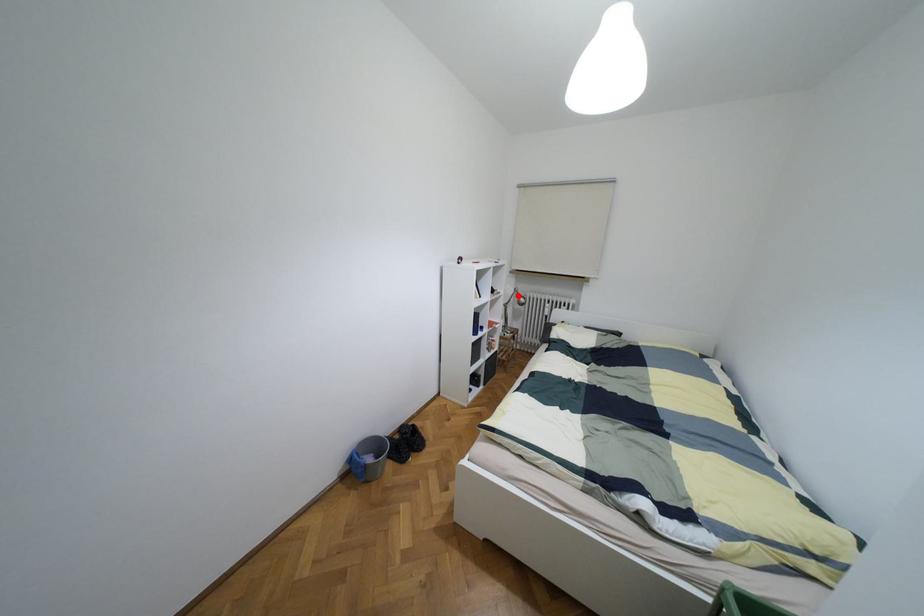
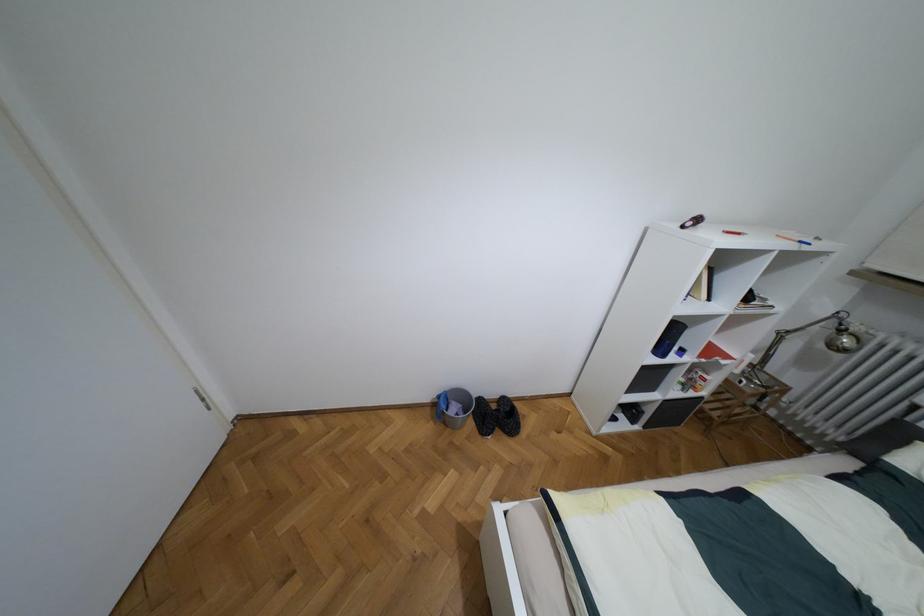
The point at the highlighted location is marked in the first image. Where is the corresponding point in the second image?

(840, 330)